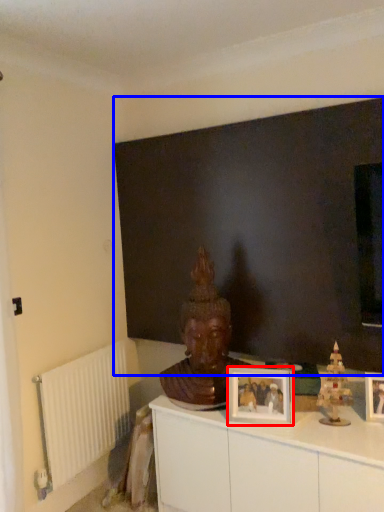
Question: Among these objects, which one is farthest to the camera, picture frame (highlighted by a red box) or backdrop (highlighted by a blue box)?

Choices:
 (A) picture frame
 (B) backdrop

Answer: (A)